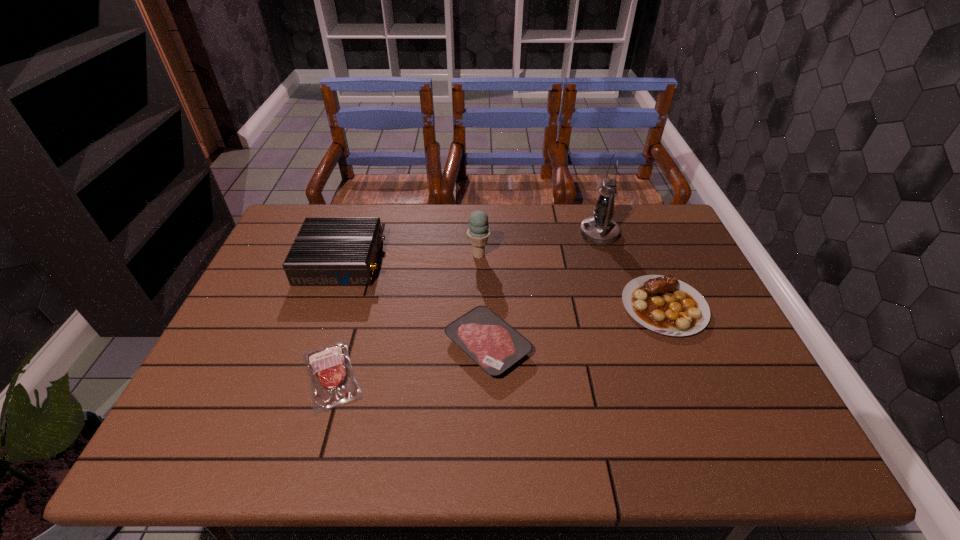
Find the location of `empty space that is in between the second tallest steak and the oil lamp`. empty space that is in between the second tallest steak and the oil lamp is located at coordinates (543, 289).

Where is `free spot between the second tallest object and the oil lamp`? The height and width of the screenshot is (540, 960). free spot between the second tallest object and the oil lamp is located at coordinates (539, 244).

Where is `vacant point located between the second steak from left to right and the leftmost steak`? The image size is (960, 540). vacant point located between the second steak from left to right and the leftmost steak is located at coordinates (409, 360).

I want to click on free spot between the router and the fourth tallest object, so click(503, 284).

You are a GUI agent. You are given a task and a screenshot of the screen. Output one action in this format:
    pyautogui.click(x=<x>, y=<y>)
    Task: Click on the object that is the fourth closest to the shortest object
    This screenshot has height=540, width=960.
    Given the screenshot: What is the action you would take?
    pyautogui.click(x=664, y=304)

Find the location of a particular element. This screenshot has height=540, width=960. object that stands as the second closest to the shortest steak is located at coordinates (327, 251).

Identify which steak is the second nearest to the fourth shortest object. Please provide its 2D coordinates. Your answer should be formatted as a tuple, i.e. [(x, y)], where the tuple contains the x and y coordinates of a point satisfying the conditions above.

[(487, 339)]

Locate an element on the screen. This screenshot has height=540, width=960. steak identified as the closest to the tallest object is located at coordinates (664, 304).

You are a GUI agent. You are given a task and a screenshot of the screen. Output one action in this format:
    pyautogui.click(x=<x>, y=<y>)
    Task: Click on the vacant space that satisfies the following two spatial constraints: 1. on the back side of the tallest object; 2. on the right side of the second tallest object
    
    Given the screenshot: What is the action you would take?
    tap(479, 233)

The height and width of the screenshot is (540, 960). I want to click on vacant area in the image that satisfies the following two spatial constraints: 1. on the front side of the second tallest object; 2. on the back panel of the router, so click(479, 261).